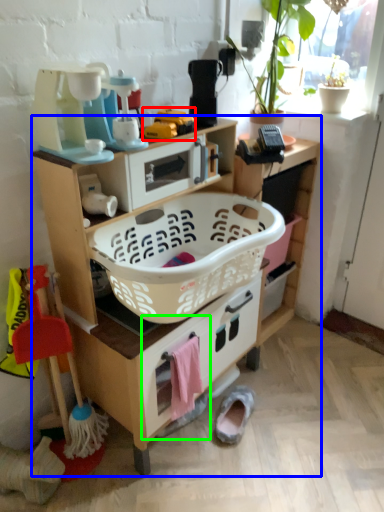
Question: Which object is positioned farthest from toy (highlighted by a red box)? Select from shelf (highlighted by a blue box) and drawer (highlighted by a green box).

Choices:
 (A) shelf
 (B) drawer

Answer: (B)